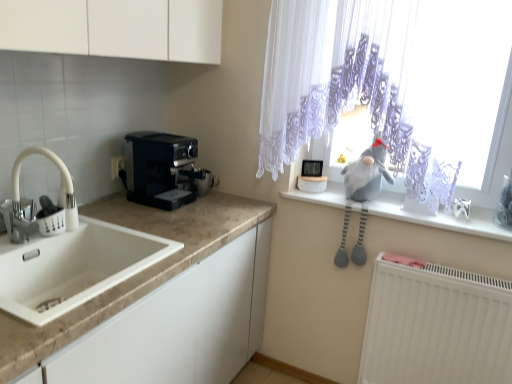
Question: Are black plastic coffee maker at left and gray fabric at upper right located far from each other?

Choices:
 (A) yes
 (B) no

Answer: (B)

Question: Could gray fabric at upper right be considered to be inside black plastic coffee maker at left?

Choices:
 (A) no
 (B) yes

Answer: (A)

Question: Is black plastic coffee maker at left outside gray fabric at upper right?

Choices:
 (A) yes
 (B) no

Answer: (A)

Question: From a real-world perspective, is black plastic coffee maker at left below gray fabric at upper right?

Choices:
 (A) no
 (B) yes

Answer: (A)

Question: Can you confirm if black plastic coffee maker at left is positioned to the left of gray fabric at upper right?

Choices:
 (A) yes
 (B) no

Answer: (A)

Question: Is black plastic coffee maker at left taller than gray fabric at upper right?

Choices:
 (A) yes
 (B) no

Answer: (A)

Question: Could you tell me if white matte radiator at lower right is turned towards white plastic electric outlet at left?

Choices:
 (A) yes
 (B) no

Answer: (B)

Question: Considering the relative sizes of white matte radiator at lower right and white plastic electric outlet at left in the image provided, is white matte radiator at lower right taller than white plastic electric outlet at left?

Choices:
 (A) no
 (B) yes

Answer: (B)

Question: From the image's perspective, is white matte radiator at lower right beneath white plastic electric outlet at left?

Choices:
 (A) no
 (B) yes

Answer: (B)

Question: Is white matte radiator at lower right positioned beyond the bounds of white plastic electric outlet at left?

Choices:
 (A) no
 (B) yes

Answer: (B)

Question: Does white matte radiator at lower right have a smaller size compared to white plastic electric outlet at left?

Choices:
 (A) no
 (B) yes

Answer: (A)

Question: From a real-world perspective, is white matte radiator at lower right physically above white plastic electric outlet at left?

Choices:
 (A) yes
 (B) no

Answer: (B)

Question: Can you confirm if white marble countertop at lower left is wider than white lace curtain at upper right?

Choices:
 (A) yes
 (B) no

Answer: (A)